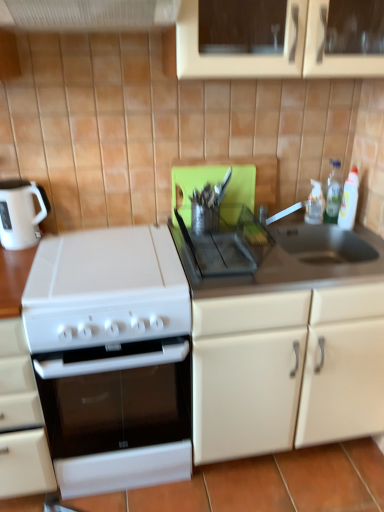
Where is `free location in front of white glossy electric kettle at left`? The height and width of the screenshot is (512, 384). free location in front of white glossy electric kettle at left is located at coordinates (21, 258).